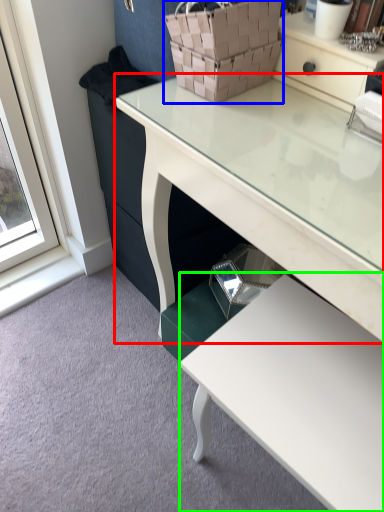
Question: Which object is the closest to the desk (highlighted by a red box)? Choose among these: basket (highlighted by a blue box) or table (highlighted by a green box).

Choices:
 (A) basket
 (B) table

Answer: (A)